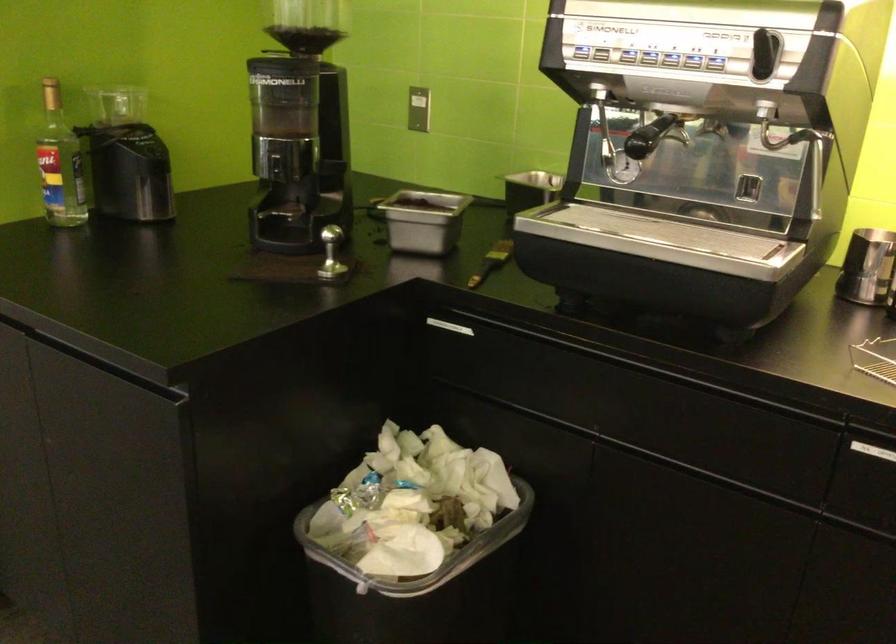
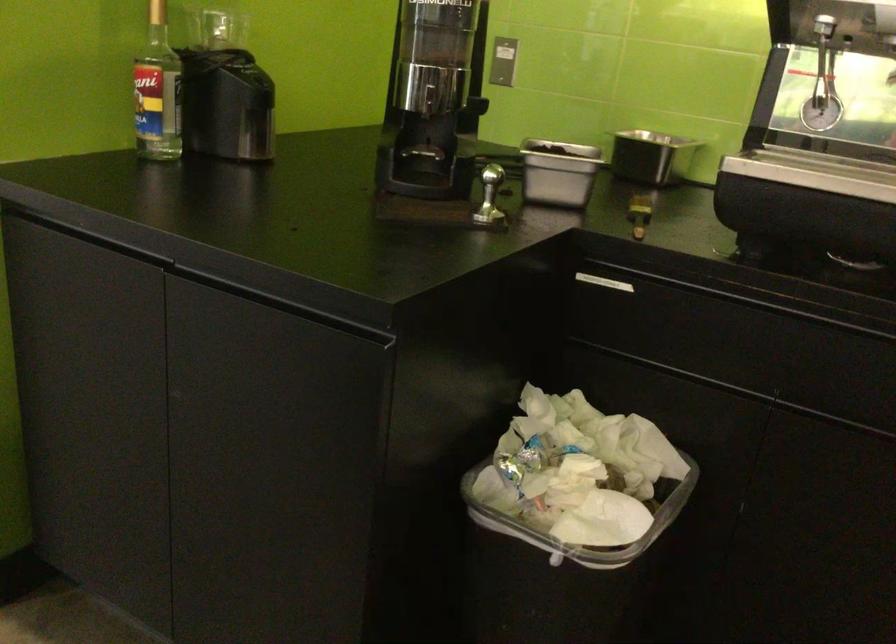
Locate, in the second image, the point that corresponds to (x=126, y=102) in the first image.

(216, 29)